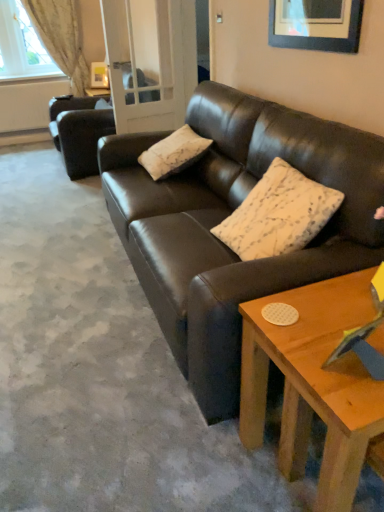
Image resolution: width=384 pixels, height=512 pixels. I want to click on shiny brown leather couch at center, marked as the 2th studio couch in a back-to-front arrangement, so click(x=229, y=214).

The height and width of the screenshot is (512, 384). Describe the element at coordinates (278, 214) in the screenshot. I see `white textured pillow at center, placed as the second pillow when sorted from top to bottom` at that location.

At what (x,y) coordinates should I click in order to perform the action: click on white textured pillow at center, the second pillow from the front. Please return your answer as a coordinate pair (x, y). Image resolution: width=384 pixels, height=512 pixels. Looking at the image, I should click on (174, 153).

Is point (80, 57) more distant than point (182, 151)?

Yes, point (80, 57) is behind point (182, 151).

Is light beige fabric curtain at upper left bigger or smaller than white textured pillow at center, which appears as the first pillow when viewed from the back?

Considering their sizes, light beige fabric curtain at upper left takes up more space than white textured pillow at center, which appears as the first pillow when viewed from the back.

Image resolution: width=384 pixels, height=512 pixels. In order to click on curtain above the white textured pillow at center, arranged as the second pillow when ordered from the bottom (from a real-world perspective) in this screenshot , I will do `click(61, 37)`.

How different are the orientations of light beige fabric curtain at upper left and white textured pillow at center, the second pillow from the front, in degrees?

They differ by 89.7 degrees in their facing directions.

Is clear glass door at center smaller than white textured pillow at center, placed as the first pillow when sorted from left to right?

No, clear glass door at center is not smaller than white textured pillow at center, placed as the first pillow when sorted from left to right.

From the image's perspective, would you say clear glass door at center is shown under white textured pillow at center, the second pillow from the front?

No, from the image's perspective, clear glass door at center is not below white textured pillow at center, the second pillow from the front.

This screenshot has height=512, width=384. Identify the location of glass door on the left side of white textured pillow at center, arranged as the second pillow when ordered from the bottom. (151, 60).

Is clear glass door at center directly adjacent to white textured pillow at center, which appears as the first pillow when viewed from the back?

They are not placed beside each other.

This screenshot has height=512, width=384. I want to click on the 1st studio couch in front of the light beige fabric curtain at upper left, so click(80, 131).

Considering the positions of objects dark brown leather couch at upper left, the first studio couch from the left, and light beige fabric curtain at upper left in the image provided, who is in front, dark brown leather couch at upper left, the first studio couch from the left, or light beige fabric curtain at upper left?

dark brown leather couch at upper left, the first studio couch from the left.

Which of these two, dark brown leather couch at upper left, acting as the 2th studio couch starting from the right, or light beige fabric curtain at upper left, is smaller?

Smaller between the two is light beige fabric curtain at upper left.

From the image's perspective, which one is positioned lower, dark brown leather couch at upper left, which ranks as the second studio couch in front-to-back order, or light beige fabric curtain at upper left?

dark brown leather couch at upper left, which ranks as the second studio couch in front-to-back order, is shown below in the image.

Based on the photo, would you say wooden coffee table at lower right is outside clear glass door at center?

Indeed, wooden coffee table at lower right is completely outside clear glass door at center.

Is wooden coffee table at lower right far from clear glass door at center?

Yes.

Is wooden coffee table at lower right wider or thinner than clear glass door at center?

Considering their sizes, wooden coffee table at lower right looks broader than clear glass door at center.

Identify the location of glass door positioned vertically above the wooden coffee table at lower right (from a real-world perspective). The image size is (384, 512). (151, 60).

Can shiny brown leather couch at center, which is counted as the 1th studio couch, starting from the right, be found inside white textured pillow at center, which appears as the first pillow when viewed from the top?

No, shiny brown leather couch at center, which is counted as the 1th studio couch, starting from the right, is not surrounded by white textured pillow at center, which appears as the first pillow when viewed from the top.

Which is less distant, (151, 155) or (318, 152)?

The point (318, 152) is closer to the camera.

In the scene shown: What's the angular difference between white textured pillow at center, arranged as the second pillow when ordered from the bottom, and shiny brown leather couch at center, acting as the 1th studio couch starting from the front,'s facing directions?

1.11 degrees separate the facing orientations of white textured pillow at center, arranged as the second pillow when ordered from the bottom, and shiny brown leather couch at center, acting as the 1th studio couch starting from the front.

Are white textured pillow at center, the second pillow from the front, and shiny brown leather couch at center, the 2th studio couch from the left, located far from each other?

No, white textured pillow at center, the second pillow from the front, is in close proximity to shiny brown leather couch at center, the 2th studio couch from the left.

Based on the photo, from the image's perspective, between white textured pillow at center, which appears as the first pillow when viewed from the top, and clear glass door at center, who is located below?

Answer: white textured pillow at center, which appears as the first pillow when viewed from the top, appears lower in the image.

Considering the positions of objects white textured pillow at center, placed as the second pillow when sorted from right to left, and clear glass door at center in the image provided, who is in front, white textured pillow at center, placed as the second pillow when sorted from right to left, or clear glass door at center?

white textured pillow at center, placed as the second pillow when sorted from right to left, is in front.

Which of these two, white textured pillow at center, placed as the second pillow when sorted from right to left, or clear glass door at center, is thinner?

clear glass door at center.

Is clear glass door at center completely or partially inside white textured pillow at center, placed as the first pillow when sorted from left to right?

Definitely not — clear glass door at center is not inside white textured pillow at center, placed as the first pillow when sorted from left to right.

Is white textured curtain at upper left taller or shorter than white textured pillow at center, acting as the 2th pillow starting from the left?

Clearly, white textured curtain at upper left is taller compared to white textured pillow at center, acting as the 2th pillow starting from the left.

From a real-world perspective, between white textured curtain at upper left and white textured pillow at center, positioned as the first pillow in right-to-left order, who is vertically lower?

white textured pillow at center, positioned as the first pillow in right-to-left order, from a real-world perspective.

Considering the relative positions of white textured curtain at upper left and white textured pillow at center, placed as the second pillow when sorted from top to bottom, in the image provided, is white textured curtain at upper left to the left of white textured pillow at center, placed as the second pillow when sorted from top to bottom, from the viewer's perspective?

Yes, white textured curtain at upper left is to the left of white textured pillow at center, placed as the second pillow when sorted from top to bottom.

From the image's perspective, who appears lower, white textured curtain at upper left or white textured pillow at center, which appears as the first pillow when ordered from the bottom?

white textured pillow at center, which appears as the first pillow when ordered from the bottom, from the image's perspective.

From a real-world perspective, count 2nd pillows downward from the light beige fabric curtain at upper left and point to it. Please provide its 2D coordinates.

[(174, 153)]

Locate an element on the screen. pillow that is the 1st one when counting forward from the clear glass door at center is located at coordinates (174, 153).

Which object lies nearer to the anchor point dark brown leather couch at upper left, the first studio couch from the left, clear glass door at center or wooden coffee table at lower right?

Among the two, clear glass door at center is located nearer to dark brown leather couch at upper left, the first studio couch from the left.

Based on their spatial positions, is dark brown leather couch at upper left, arranged as the 1th studio couch when viewed from the back, or clear glass door at center further from white textured pillow at center, acting as the 2th pillow starting from the left?

dark brown leather couch at upper left, arranged as the 1th studio couch when viewed from the back, is further to white textured pillow at center, acting as the 2th pillow starting from the left.

When comparing their distances from white textured pillow at center, which appears as the first pillow when viewed from the back, does dark brown leather couch at upper left, which ranks as the second studio couch in front-to-back order, or white textured pillow at center, which appears as the first pillow when ordered from the bottom, seem closer?

white textured pillow at center, which appears as the first pillow when ordered from the bottom.

From the image, which object appears to be nearer to light beige fabric curtain at upper left, white textured curtain at upper left or white textured pillow at center, placed as the second pillow when sorted from right to left?

Based on the image, white textured curtain at upper left appears to be nearer to light beige fabric curtain at upper left.

Which object lies nearer to the anchor point white textured pillow at center, which appears as the first pillow when ordered from the bottom, clear glass door at center or light beige fabric curtain at upper left?

Based on the image, clear glass door at center appears to be nearer to white textured pillow at center, which appears as the first pillow when ordered from the bottom.

From the image, which object appears to be farther from white textured curtain at upper left, dark brown leather couch at upper left, arranged as the 1th studio couch when viewed from the back, or white textured pillow at center, which is counted as the 2th pillow, starting from the back?

The object further to white textured curtain at upper left is white textured pillow at center, which is counted as the 2th pillow, starting from the back.

Considering their positions, is white textured pillow at center, which is counted as the 2th pillow, starting from the back, positioned further to white textured curtain at upper left than shiny brown leather couch at center, which is counted as the 1th studio couch, starting from the right?

The object further to white textured curtain at upper left is white textured pillow at center, which is counted as the 2th pillow, starting from the back.

Which object lies nearer to the anchor point white textured pillow at center, which appears as the first pillow when viewed from the top, wooden coffee table at lower right or white textured pillow at center, placed as the second pillow when sorted from top to bottom?

Among the two, white textured pillow at center, placed as the second pillow when sorted from top to bottom, is located nearer to white textured pillow at center, which appears as the first pillow when viewed from the top.

Locate an element on the screen. The image size is (384, 512). glass door positioned between wooden coffee table at lower right and dark brown leather couch at upper left, which ranks as the second studio couch in front-to-back order, from near to far is located at coordinates (151, 60).

The width and height of the screenshot is (384, 512). Identify the location of glass door between white textured pillow at center, placed as the second pillow when sorted from top to bottom, and white textured curtain at upper left in the front-back direction. (151, 60).

Where is `pillow between wooden coffee table at lower right and white textured pillow at center, which appears as the first pillow when viewed from the top, in the front-back direction`? The height and width of the screenshot is (512, 384). pillow between wooden coffee table at lower right and white textured pillow at center, which appears as the first pillow when viewed from the top, in the front-back direction is located at coordinates (278, 214).

The width and height of the screenshot is (384, 512). What are the coordinates of `glass door positioned between wooden coffee table at lower right and white textured curtain at upper left from near to far` in the screenshot? It's located at (151, 60).